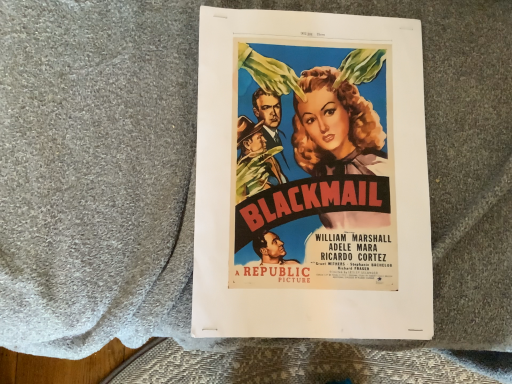
In order to click on matte paper poster at center in this screenshot , I will do `click(311, 178)`.

What do you see at coordinates (311, 178) in the screenshot? I see `matte paper poster at center` at bounding box center [311, 178].

Where is `matte paper poster at center`? matte paper poster at center is located at coordinates (x=311, y=178).